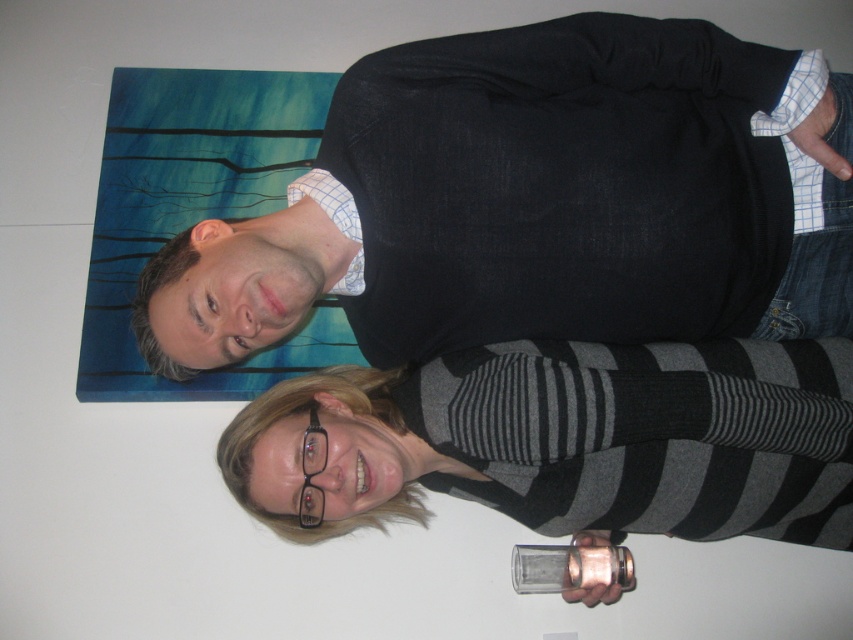
Question: Can you confirm if black cotton sweater at upper center is positioned to the right of clear glass at lower center?

Choices:
 (A) yes
 (B) no

Answer: (B)

Question: Does black cotton sweater at upper center appear under clear glass at lower center?

Choices:
 (A) yes
 (B) no

Answer: (B)

Question: Which of the following is the closest to the observer?

Choices:
 (A) (838, 243)
 (B) (793, 474)

Answer: (A)

Question: From the image, what is the correct spatial relationship of black cotton sweater at upper center in relation to clear glass at lower center?

Choices:
 (A) above
 (B) below

Answer: (A)